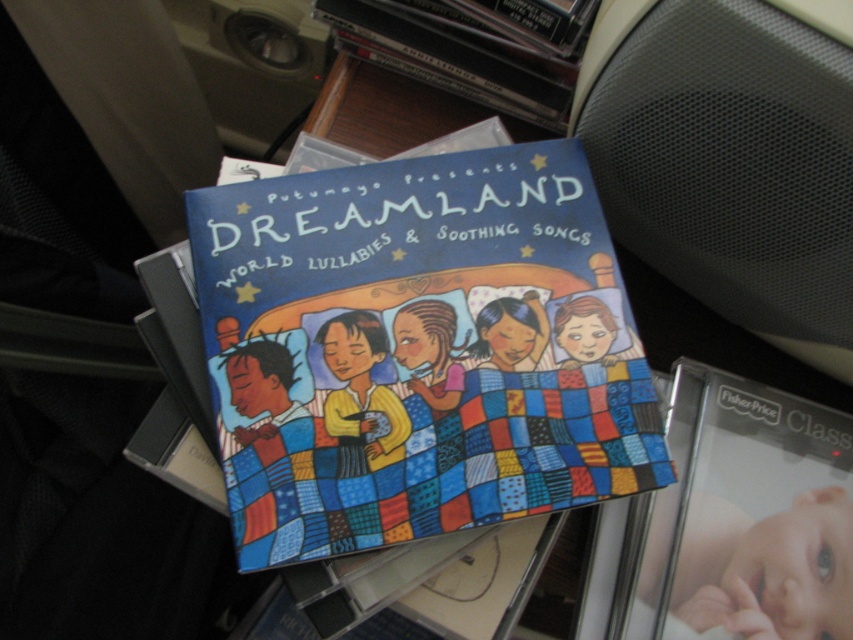
You are organizing a music collection and need to place the smooth skin baby at lower right and the matte black book at upper center on a shelf. Given their sizes, which object will require more horizontal space on the shelf?

The matte black book at upper center will require more horizontal space on the shelf since its width is greater than the smooth skin baby at lower right.

You are designing a digital interface to display the CDs from the scene. The interface requires the position of the smooth skin baby at lower right to be marked with a red dot. What are the exact coordinates where you should place the red dot?

The exact coordinates for the smooth skin baby at lower right are at point (767,568), so place the red dot there.

You are organizing a music library and need to place a new CD case that is 12 inches wide between the matte blue quilted book at center and the matte black book at upper center. Based on the current spacing, will there be enough room for the new CD case?

The distance between the matte blue quilted book at center and the matte black book at upper center is 11.53 inches. Since the new CD case is 12 inches wide, it will not fit in the available space.